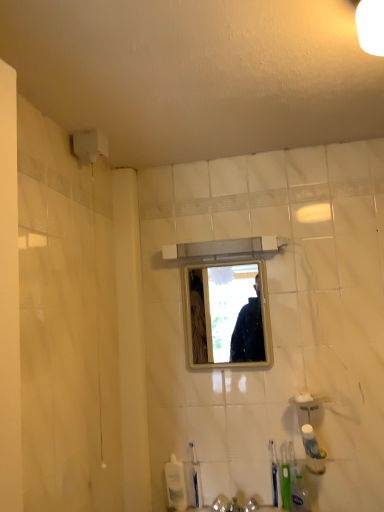
Question: Considering the positions of blue plastic toothbrush at lower center, which is counted as the 1th toothbrush, starting from the left, and green plastic toothbrush at lower right, which is the 2th toothbrush in right-to-left order, in the image, is blue plastic toothbrush at lower center, which is counted as the 1th toothbrush, starting from the left, taller or shorter than green plastic toothbrush at lower right, which is the 2th toothbrush in right-to-left order,?

Choices:
 (A) short
 (B) tall

Answer: (A)

Question: Is blue plastic toothbrush at lower center, which appears as the 3th toothbrush when viewed from the right, bigger or smaller than green plastic toothbrush at lower right, which ranks as the second toothbrush in left-to-right order?

Choices:
 (A) big
 (B) small

Answer: (B)

Question: Which of these objects is positioned farthest from the green plastic toothbrush at lower right, which is the 2th toothbrush in right-to-left order?

Choices:
 (A) blue plastic toothbrush at lower center, which appears as the 3th toothbrush when viewed from the right
 (B) clear plastic bottle at lower center, the first toiletry when ordered from left to right
 (C) white plastic toothpaste tube at lower right, positioned as the 2th toiletry in left-to-right order
 (D) green plastic toothbrush at lower right, which is the 1th toothbrush from right to left
 (E) clear glass mirror at center

Answer: (E)

Question: Which of these objects is positioned farthest from the clear plastic bottle at lower center, the first toiletry when ordered from left to right?

Choices:
 (A) green plastic toothbrush at lower right, which is the 2th toothbrush in right-to-left order
 (B) white plastic toothpaste tube at lower right, which is the first toiletry from right to left
 (C) green plastic toothbrush at lower right, which ranks as the third toothbrush in left-to-right order
 (D) blue plastic toothbrush at lower center, which appears as the 3th toothbrush when viewed from the right
 (E) clear glass mirror at center

Answer: (E)